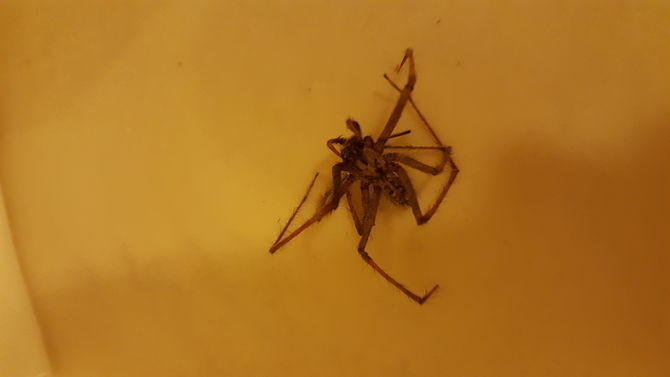
Identify the location of corner. (45, 334).